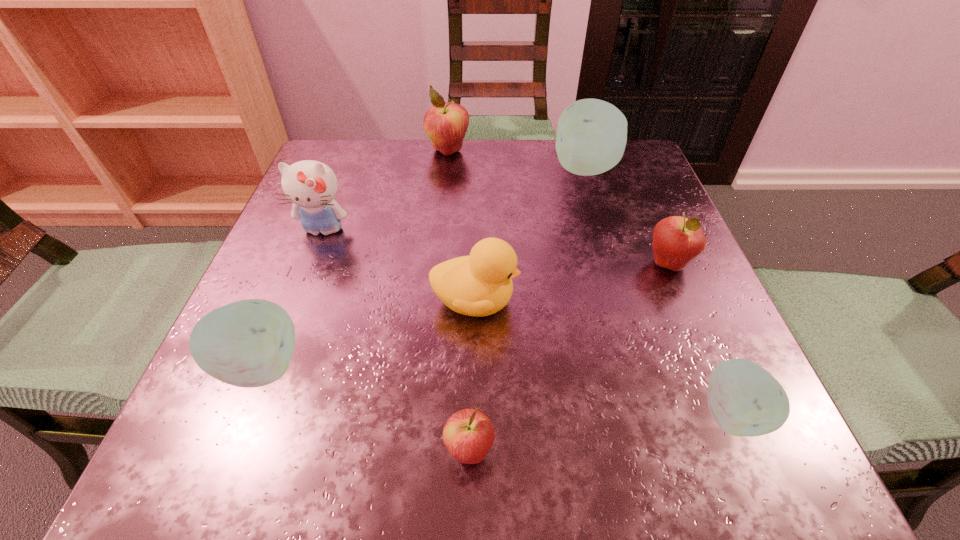
The height and width of the screenshot is (540, 960). Identify the location of unoccupied area between the smallest white apple and the third farthest apple. (700, 339).

Locate an element on the screen. vacant region between the sixth nearest object and the smallest white apple is located at coordinates (527, 322).

Find the location of `free spot between the farthest white apple and the rightmost red apple`. free spot between the farthest white apple and the rightmost red apple is located at coordinates (628, 217).

Where is `empty space that is in between the biggest red apple and the second smallest white apple`? empty space that is in between the biggest red apple and the second smallest white apple is located at coordinates (354, 259).

At what (x,y) coordinates should I click in order to perform the action: click on free space between the leftmost white apple and the farthest white apple. Please return your answer as a coordinate pair (x, y). This screenshot has height=540, width=960. Looking at the image, I should click on (423, 268).

Where is `free space between the smallest red apple and the second nearest red apple`? The width and height of the screenshot is (960, 540). free space between the smallest red apple and the second nearest red apple is located at coordinates (569, 357).

Find the location of a particular element. vacant area that lies between the duck and the sixth nearest object is located at coordinates (399, 266).

Identify the location of object that stands as the sixth closest to the biggest red apple. (468, 435).

Where is `object that stands as the second closest to the second biggest white apple`? object that stands as the second closest to the second biggest white apple is located at coordinates (311, 186).

Identify which apple is the closest to the second biggest red apple. Please provide its 2D coordinates. Your answer should be formatted as a tuple, i.e. [(x, y)], where the tuple contains the x and y coordinates of a point satisfying the conditions above.

[(591, 138)]